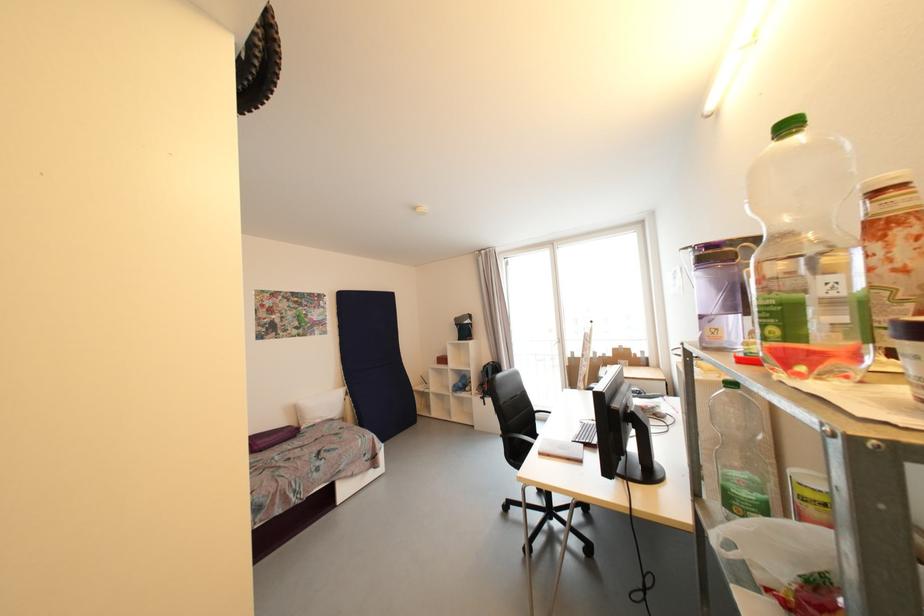
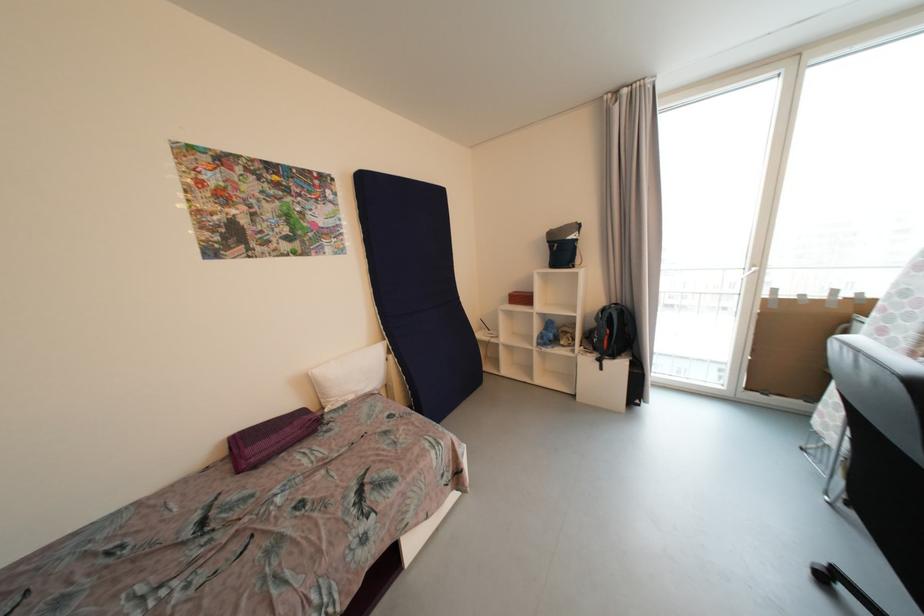
Locate, in the second image, the point that corresponds to the point at 353,399 in the first image.

(396, 359)